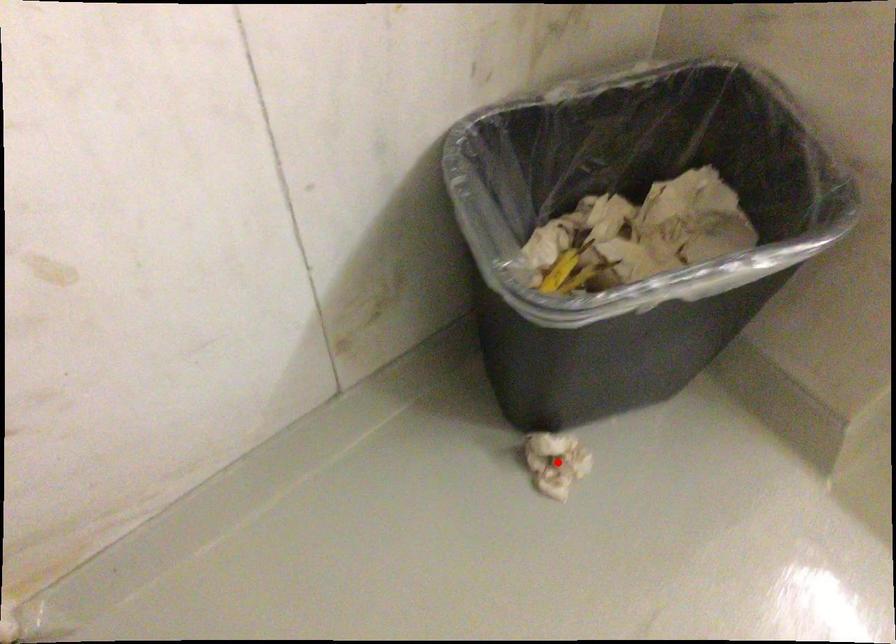
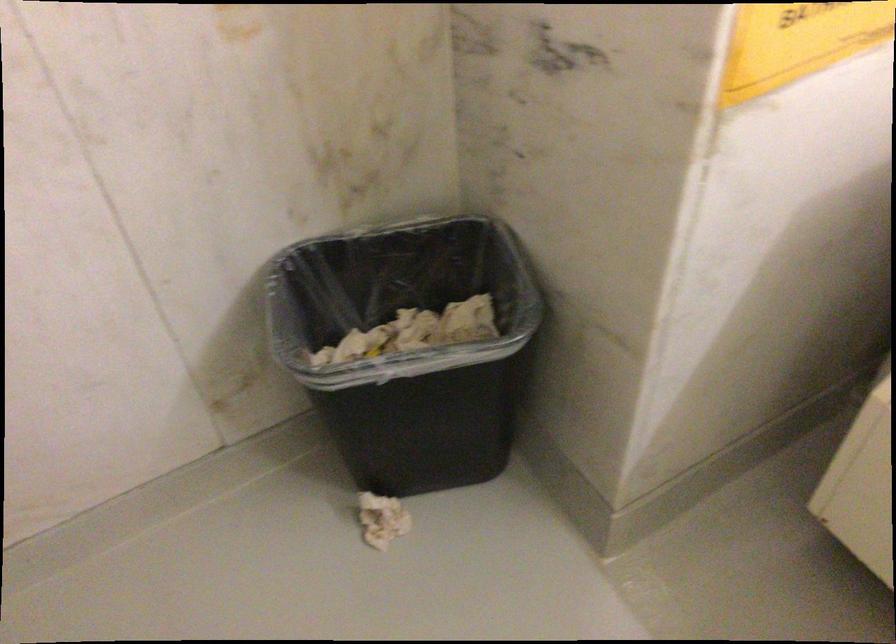
Find the pixel in the second image that matches the highlighted location in the first image.

(382, 520)